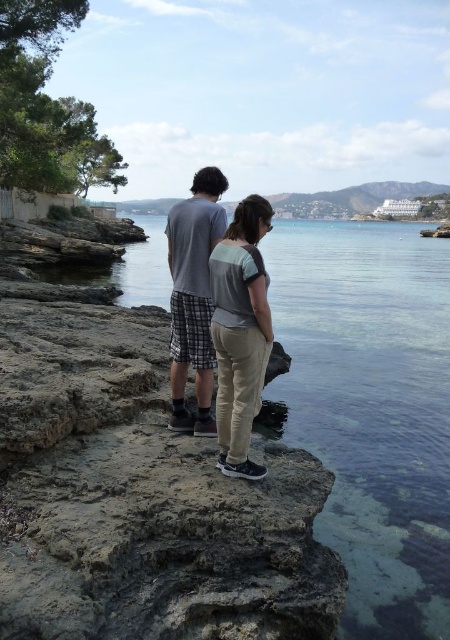
Can you confirm if light gray cotton pants at center is wider than gray cotton t-shirt at center?

No, light gray cotton pants at center is not wider than gray cotton t-shirt at center.

Consider the image. Is light gray cotton pants at center to the right of gray cotton t-shirt at center from the viewer's perspective?

Indeed, light gray cotton pants at center is positioned on the right side of gray cotton t-shirt at center.

Between point (220, 349) and point (184, 321), which one is positioned in front?

Positioned in front is point (220, 349).

At what (x,y) coordinates should I click in order to perform the action: click on light gray cotton pants at center. Please return your answer as a coordinate pair (x, y). Looking at the image, I should click on (241, 332).

Which of these two, clear water at center or gray cotton t-shirt at center, stands shorter?

With less height is gray cotton t-shirt at center.

Where is `clear water at center`? This screenshot has height=640, width=450. clear water at center is located at coordinates tap(372, 408).

Who is positioned more to the left, clear water at center or light gray cotton pants at center?

Positioned to the left is light gray cotton pants at center.

Is clear water at center positioned at the back of light gray cotton pants at center?

Yes, clear water at center is behind light gray cotton pants at center.

Image resolution: width=450 pixels, height=640 pixels. What do you see at coordinates (372, 408) in the screenshot? I see `clear water at center` at bounding box center [372, 408].

Where is `clear water at center`? The image size is (450, 640). clear water at center is located at coordinates (372, 408).